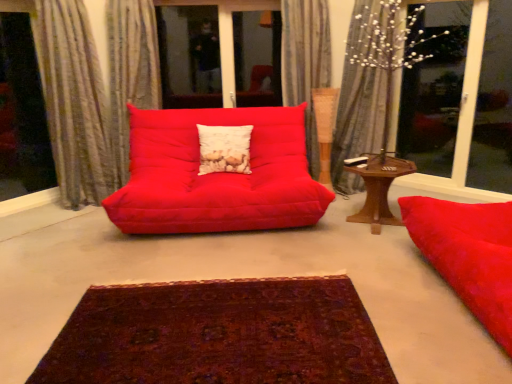
Where is `vacant region in front of wooden hexagonal table at right`? The width and height of the screenshot is (512, 384). vacant region in front of wooden hexagonal table at right is located at coordinates (382, 247).